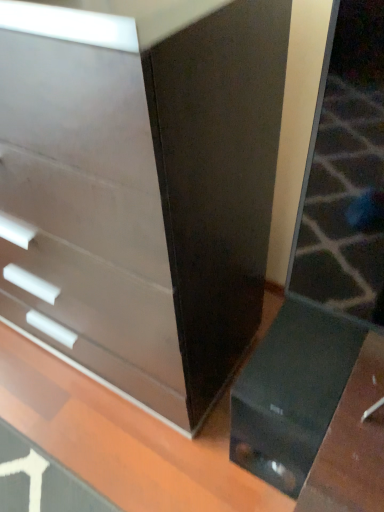
Question: Does point (97, 339) appear closer or farther from the camera than point (266, 489)?

Choices:
 (A) closer
 (B) farther

Answer: (B)

Question: Choose the correct answer: Is matte white chest of drawers at left inside glossy black table at lower right or outside it?

Choices:
 (A) inside
 (B) outside

Answer: (B)

Question: Is matte white chest of drawers at left wider or thinner than glossy black table at lower right?

Choices:
 (A) wide
 (B) thin

Answer: (B)

Question: From the image's perspective, is glossy black table at lower right positioned above or below matte white chest of drawers at left?

Choices:
 (A) above
 (B) below

Answer: (B)

Question: Considering the positions of glossy black table at lower right and matte white chest of drawers at left in the image, is glossy black table at lower right taller or shorter than matte white chest of drawers at left?

Choices:
 (A) short
 (B) tall

Answer: (A)

Question: Is point (253, 509) positioned closer to the camera than point (132, 281)?

Choices:
 (A) farther
 (B) closer

Answer: (A)

Question: In terms of width, does glossy black table at lower right look wider or thinner when compared to matte white chest of drawers at left?

Choices:
 (A) wide
 (B) thin

Answer: (A)